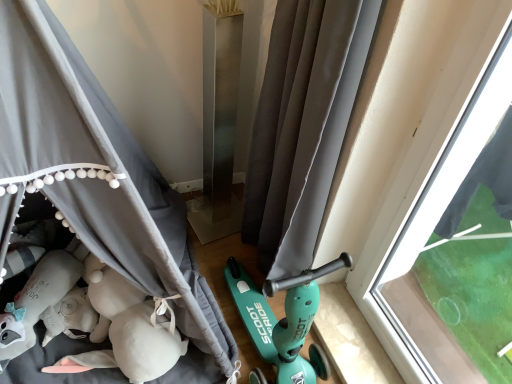
Question: Is gray fabric curtain at center, which ranks as the second curtain in right-to-left order, spatially inside transparent glass window at right, or outside of it?

Choices:
 (A) inside
 (B) outside

Answer: (B)

Question: Is point (155, 249) positioned closer to the camera than point (416, 147)?

Choices:
 (A) closer
 (B) farther

Answer: (A)

Question: Which of these objects is positioned farthest from the transparent glass window at right?

Choices:
 (A) gray fabric curtain at center, arranged as the 2th curtain when viewed from the left
 (B) gray fabric curtain at center, arranged as the 1th curtain when viewed from the left

Answer: (B)

Question: Which of these objects is positioned closest to the gray fabric curtain at center, the 1th curtain in the right-to-left sequence?

Choices:
 (A) gray fabric curtain at center, which ranks as the second curtain in right-to-left order
 (B) transparent glass window at right

Answer: (B)